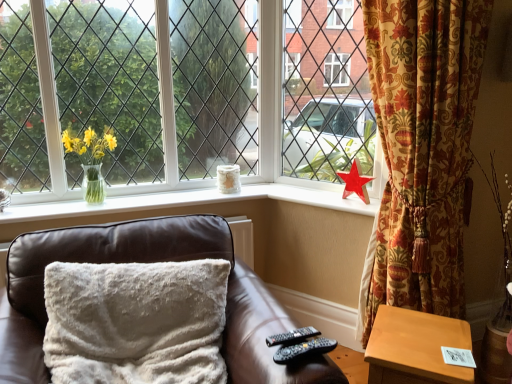
Question: Is matte glass vase at upper center, acting as the 2th daffodil starting from the left, turned away from brown leather couch at center?

Choices:
 (A) yes
 (B) no

Answer: (B)

Question: Would you consider matte glass vase at upper center, acting as the 2th daffodil starting from the left, to be distant from brown leather couch at center?

Choices:
 (A) no
 (B) yes

Answer: (B)

Question: Is matte glass vase at upper center, which ranks as the first daffodil in right-to-left order, surrounding brown leather couch at center?

Choices:
 (A) yes
 (B) no

Answer: (B)

Question: Is matte glass vase at upper center, acting as the 2th daffodil starting from the left, positioned beyond the bounds of brown leather couch at center?

Choices:
 (A) no
 (B) yes

Answer: (B)

Question: Is matte glass vase at upper center, which ranks as the first daffodil in right-to-left order, to the right of brown leather couch at center from the viewer's perspective?

Choices:
 (A) yes
 (B) no

Answer: (A)

Question: Is light brown wooden table at lower right inside the boundaries of gold floral curtain at right, or outside?

Choices:
 (A) outside
 (B) inside

Answer: (A)

Question: Considering the positions of light brown wooden table at lower right and gold floral curtain at right in the image, is light brown wooden table at lower right taller or shorter than gold floral curtain at right?

Choices:
 (A) short
 (B) tall

Answer: (A)

Question: Considering the positions of point (403, 339) and point (378, 249), is point (403, 339) closer or farther from the camera than point (378, 249)?

Choices:
 (A) farther
 (B) closer

Answer: (B)

Question: Would you say light brown wooden table at lower right is to the left or to the right of gold floral curtain at right in the picture?

Choices:
 (A) right
 (B) left

Answer: (B)

Question: Considering their positions, is white glossy vase at upper center located in front of or behind red plastic star at right?

Choices:
 (A) front
 (B) behind

Answer: (A)

Question: Based on their sizes in the image, would you say white glossy vase at upper center is bigger or smaller than red plastic star at right?

Choices:
 (A) small
 (B) big

Answer: (A)

Question: Is white glossy vase at upper center wider or thinner than red plastic star at right?

Choices:
 (A) thin
 (B) wide

Answer: (B)

Question: Is white glossy vase at upper center situated inside red plastic star at right or outside?

Choices:
 (A) outside
 (B) inside

Answer: (A)

Question: Is point (6, 357) closer or farther from the camera than point (304, 329)?

Choices:
 (A) closer
 (B) farther

Answer: (A)

Question: Considering the positions of brown leather couch at center and black plastic remote at lower right, the 1th remote in the back-to-front sequence, in the image, is brown leather couch at center wider or thinner than black plastic remote at lower right, the 1th remote in the back-to-front sequence,?

Choices:
 (A) thin
 (B) wide

Answer: (B)